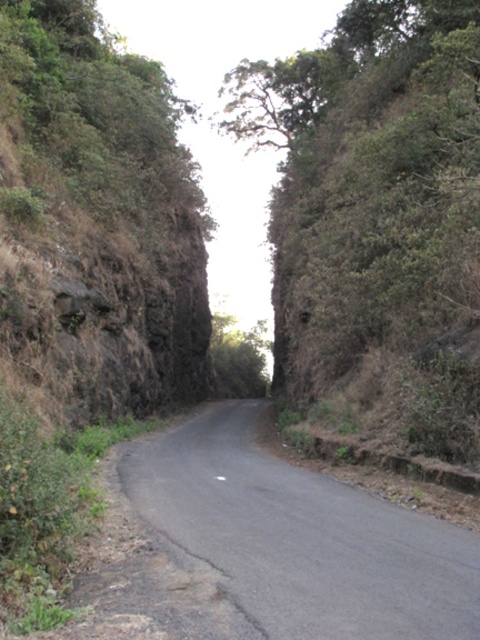
You are a hiker trying to navigate the narrow road. You see a green leafy tree at center and a black asphalt road at center. Which object takes up more space in the image?

The green leafy tree at center is bigger than the black asphalt road at center, so the tree takes up more space in the image.

You are driving a car and need to navigate the black asphalt road at center. There is a green leafy tree at center blocking your view. Can you see the road ahead clearly?

The black asphalt road at center is behind the green leafy tree at center, so the tree is blocking the view of the road ahead.

You are driving a car and need to park on the black asphalt road at center. There is a green leafy tree at center nearby. Which side of the road should you park on to avoid blocking the road?

The green leafy tree at center is positioned on the right side of the black asphalt road at center, so you should park on the left side of the black asphalt road at center to avoid blocking the road.